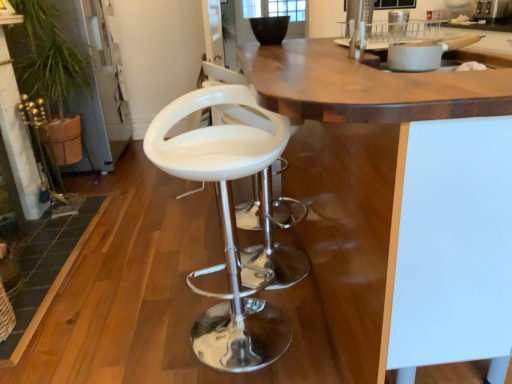
Question: From the image's perspective, is wooden at center over white ceramic pot at upper right?

Choices:
 (A) no
 (B) yes

Answer: (A)

Question: Is white ceramic pot at upper right located within wooden at center?

Choices:
 (A) no
 (B) yes

Answer: (B)

Question: Can you confirm if wooden at center is shorter than white ceramic pot at upper right?

Choices:
 (A) no
 (B) yes

Answer: (A)

Question: Is wooden at center smaller than white ceramic pot at upper right?

Choices:
 (A) yes
 (B) no

Answer: (B)

Question: Is the position of wooden at center less distant than that of white ceramic pot at upper right?

Choices:
 (A) no
 (B) yes

Answer: (B)

Question: Which is correct: white glossy bar stool at center is inside white ceramic pot at upper right, or outside of it?

Choices:
 (A) inside
 (B) outside

Answer: (B)

Question: Relative to white ceramic pot at upper right, is white glossy bar stool at center in front or behind?

Choices:
 (A) front
 (B) behind

Answer: (A)

Question: Considering the positions of white glossy bar stool at center and white ceramic pot at upper right in the image, is white glossy bar stool at center wider or thinner than white ceramic pot at upper right?

Choices:
 (A) thin
 (B) wide

Answer: (B)

Question: From the image's perspective, is white glossy bar stool at center located above or below white ceramic pot at upper right?

Choices:
 (A) below
 (B) above

Answer: (A)

Question: Looking at the image, does white ceramic pot at upper right seem bigger or smaller compared to wooden at center?

Choices:
 (A) big
 (B) small

Answer: (B)

Question: Considering the relative positions of white ceramic pot at upper right and wooden at center in the image provided, is white ceramic pot at upper right to the left or to the right of wooden at center?

Choices:
 (A) right
 (B) left

Answer: (A)

Question: From a real-world perspective, relative to wooden at center, is white ceramic pot at upper right vertically above or below?

Choices:
 (A) below
 (B) above

Answer: (B)

Question: From the image's perspective, is white ceramic pot at upper right positioned above or below wooden at center?

Choices:
 (A) above
 (B) below

Answer: (A)

Question: Looking at the image, does white glossy bar stool at center seem bigger or smaller compared to wooden at center?

Choices:
 (A) small
 (B) big

Answer: (A)

Question: Considering the relative positions of white glossy bar stool at center and wooden at center in the image provided, is white glossy bar stool at center to the left or to the right of wooden at center?

Choices:
 (A) right
 (B) left

Answer: (B)